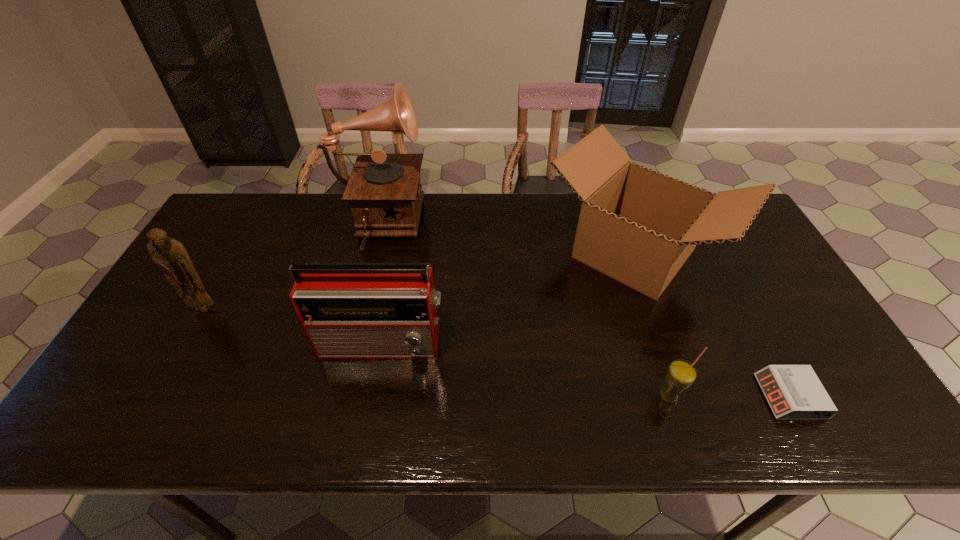
The height and width of the screenshot is (540, 960). I want to click on free area in between the figurine and the radio receiver, so click(294, 326).

Where is `vacant area between the alarm clock and the second shortest object`? vacant area between the alarm clock and the second shortest object is located at coordinates (729, 396).

You are a GUI agent. You are given a task and a screenshot of the screen. Output one action in this format:
    pyautogui.click(x=<x>, y=<y>)
    Task: Click on the vacant space in between the tallest object and the box
    This screenshot has width=960, height=540.
    Given the screenshot: What is the action you would take?
    pyautogui.click(x=506, y=241)

You are a GUI agent. You are given a task and a screenshot of the screen. Output one action in this format:
    pyautogui.click(x=<x>, y=<y>)
    Task: Click on the free area in between the alarm clock and the fourth farthest object
    This screenshot has width=960, height=540.
    Given the screenshot: What is the action you would take?
    point(587,369)

The height and width of the screenshot is (540, 960). I want to click on object identified as the second closest to the box, so [x=681, y=374].

Point out which object is positioned as the fifth nearest to the alarm clock. Please provide its 2D coordinates. Your answer should be formatted as a tuple, i.e. [(x, y)], where the tuple contains the x and y coordinates of a point satisfying the conditions above.

[(170, 254)]

Identify the location of vacant space that satisfies the following two spatial constraints: 1. on the horn of the record player; 2. on the right side of the second shortest object. (336, 397).

The height and width of the screenshot is (540, 960). In order to click on free location that satisfies the following two spatial constraints: 1. on the horn of the tallest object; 2. on the left side of the box in this screenshot , I will do `click(372, 253)`.

Find the location of a particular element. Image resolution: width=960 pixels, height=540 pixels. vacant space that satisfies the following two spatial constraints: 1. on the horn of the shortest object; 2. on the left side of the record player is located at coordinates (336, 396).

Where is `free space that satisfies the following two spatial constraints: 1. on the back side of the fifth tallest object; 2. on the horn of the record player`? free space that satisfies the following two spatial constraints: 1. on the back side of the fifth tallest object; 2. on the horn of the record player is located at coordinates (613, 228).